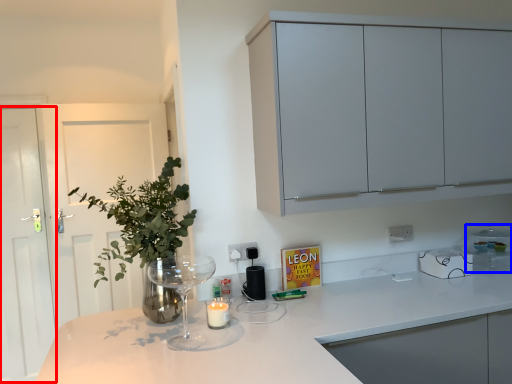
Question: Which point is closer to the camera, glass door (highlighted by a red box) or appliance (highlighted by a blue box)?

Choices:
 (A) glass door
 (B) appliance

Answer: (B)